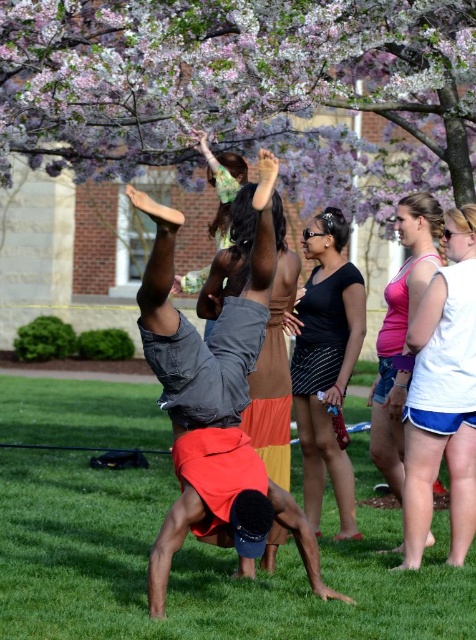
Is point (406, 624) positioned behind point (319, 256)?

No, it is in front of (319, 256).

The height and width of the screenshot is (640, 476). Find the location of `green grass at center`. green grass at center is located at coordinates (198, 566).

Find the location of a particular element. green grass at center is located at coordinates (198, 566).

Which is above, green grass at center or pink fabric shorts at right?

pink fabric shorts at right is higher up.

Is green grass at center bigger than pink fabric shorts at right?

Correct, green grass at center is larger in size than pink fabric shorts at right.

Who is more forward, [11,557] or [377,429]?

Point [11,557] is in front.

Find the location of a particular element. This screenshot has height=640, width=476. green grass at center is located at coordinates (198, 566).

Between denim shorts at center and black striped skirt at center, which one appears on the right side from the viewer's perspective?

black striped skirt at center

Can you confirm if denim shorts at center is positioned above black striped skirt at center?

No, denim shorts at center is not above black striped skirt at center.

Measure the distance between denim shorts at center and camera.

15.20 feet

Locate an element on the screen. This screenshot has width=476, height=640. denim shorts at center is located at coordinates (197, 332).